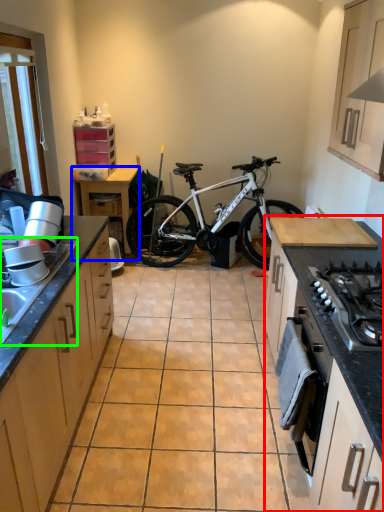
Question: Which is nearer to the countertop (highlighted by a red box)? table (highlighted by a blue box) or sink (highlighted by a green box).

Choices:
 (A) table
 (B) sink

Answer: (B)